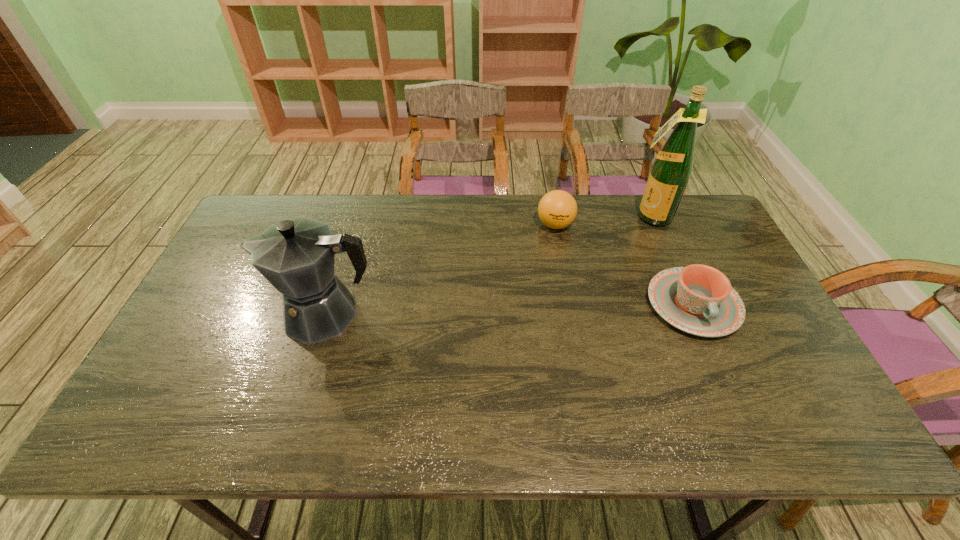
This screenshot has height=540, width=960. In order to click on vacant region at the far edge in this screenshot , I will do `click(531, 235)`.

In the image, there is a desktop. What are the coordinates of `blank space at the near edge` in the screenshot? It's located at (460, 394).

At what (x,y) coordinates should I click in order to perform the action: click on free space at the right edge of the desktop. Please return your answer as a coordinate pair (x, y). The image size is (960, 540). Looking at the image, I should click on (711, 265).

Find the location of a particular element. The width and height of the screenshot is (960, 540). vacant space at the far left corner of the desktop is located at coordinates (266, 225).

This screenshot has width=960, height=540. I want to click on vacant region at the far right corner of the desktop, so click(x=710, y=214).

Find the location of a particular element. vacant area that lies between the shortest object and the liquor is located at coordinates (671, 260).

The height and width of the screenshot is (540, 960). I want to click on free space between the third object from right to left and the leftmost object, so click(441, 269).

Locate an element on the screen. This screenshot has height=540, width=960. vacant space in between the third shortest object and the chinaware is located at coordinates (510, 309).

Where is `free spot between the second tallest object and the chinaware`? free spot between the second tallest object and the chinaware is located at coordinates (510, 309).

Identify the location of unoccupied area between the third object from right to left and the second tallest object. (441, 269).